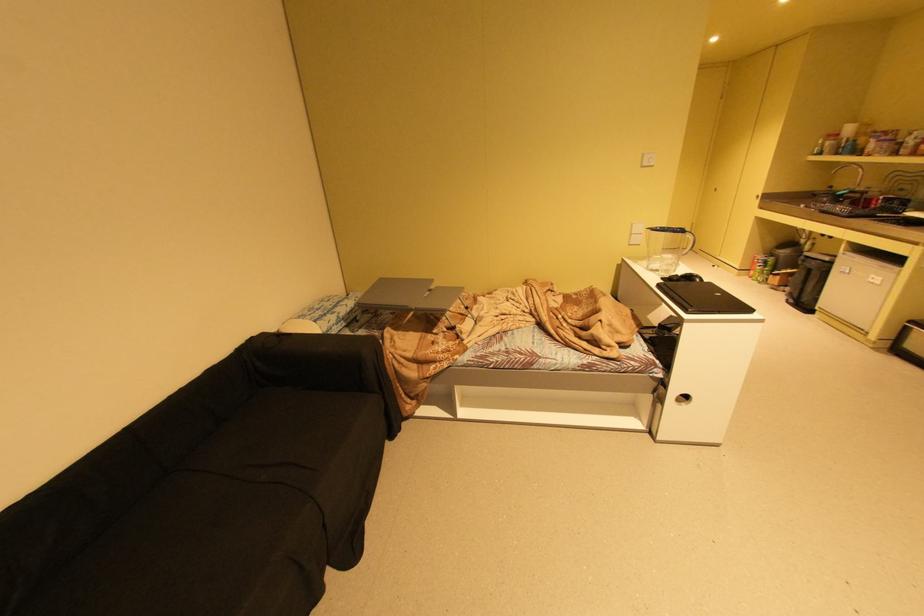
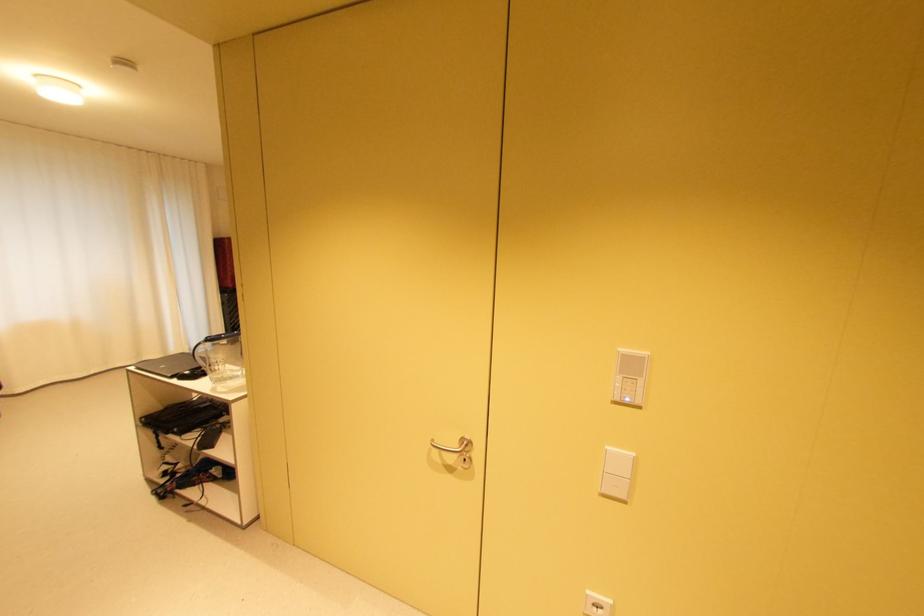
Question: I am providing you with two images of the same scene from different viewpoints. Please identify which objects are invisible in image2.

Choices:
 (A) white light switch
 (B) container with green lid
 (C) white power outlet
 (D) cabinet handle hole

Answer: (D)